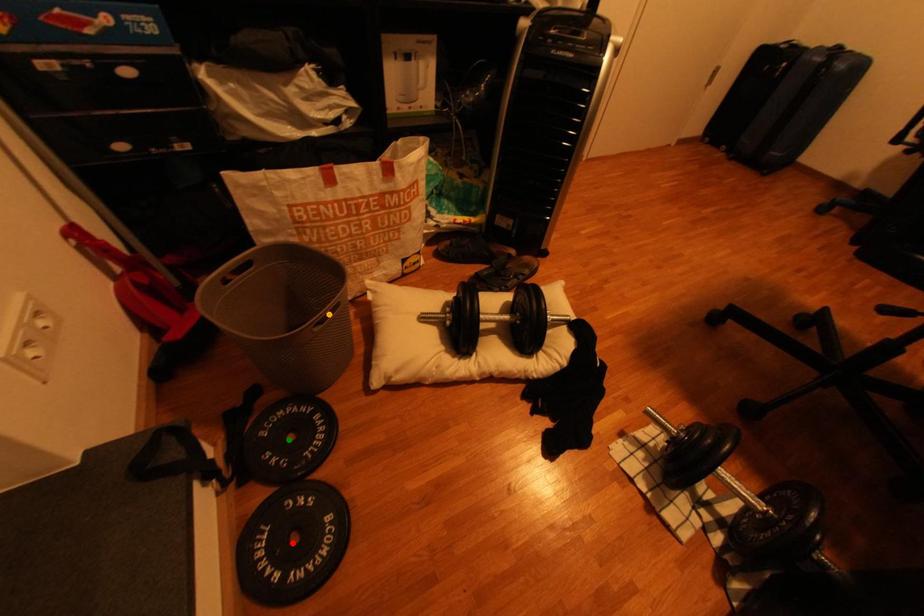
Order these from farthest to nearest:
A) green point
B) orange point
C) red point

orange point
green point
red point